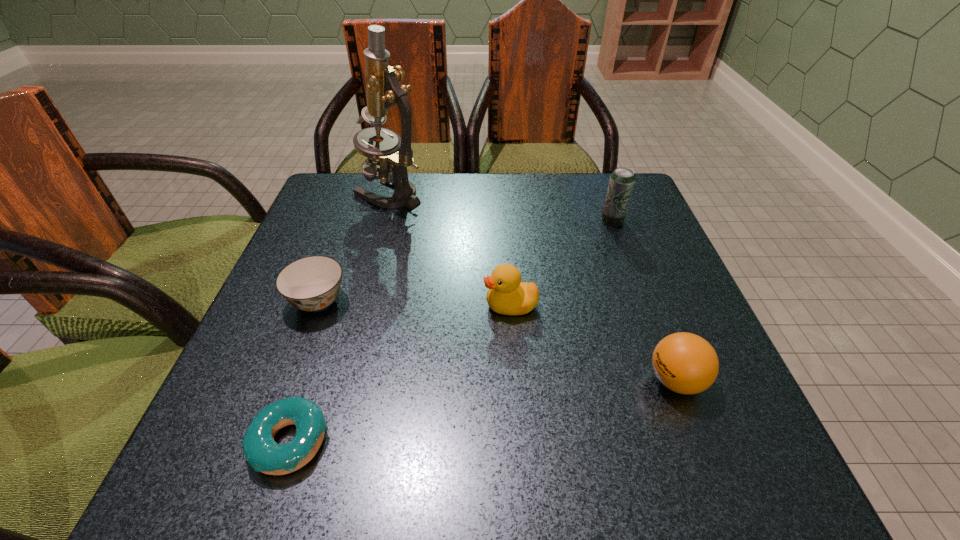
At what (x,y) coordinates should I click in order to perform the action: click on free space at the far edge. Please return your answer as a coordinate pair (x, y). Looking at the image, I should click on (526, 174).

Find the location of a particular element. The image size is (960, 540). free region at the near edge is located at coordinates (642, 445).

Where is `vacant space at the left edge`? Image resolution: width=960 pixels, height=540 pixels. vacant space at the left edge is located at coordinates (329, 247).

This screenshot has height=540, width=960. In the image, there is a desktop. Find the location of `blank space at the right edge`. blank space at the right edge is located at coordinates (660, 235).

Find the location of a particular element. This screenshot has width=960, height=540. vacant space at the far left corner is located at coordinates (356, 197).

In the image, there is a desktop. Where is `vacant region at the far right corner`? This screenshot has height=540, width=960. vacant region at the far right corner is located at coordinates (631, 199).

Where is `vacant space at the near right corner of the desktop`? The height and width of the screenshot is (540, 960). vacant space at the near right corner of the desktop is located at coordinates (757, 442).

This screenshot has height=540, width=960. In order to click on empty space that is in between the nearest object and the ping-pong ball in this screenshot , I will do `click(483, 411)`.

Where is `unoccupied position between the duck and the microscope`? The width and height of the screenshot is (960, 540). unoccupied position between the duck and the microscope is located at coordinates (450, 249).

This screenshot has height=540, width=960. Identify the location of free space between the tallest object and the soup bowl. (353, 247).